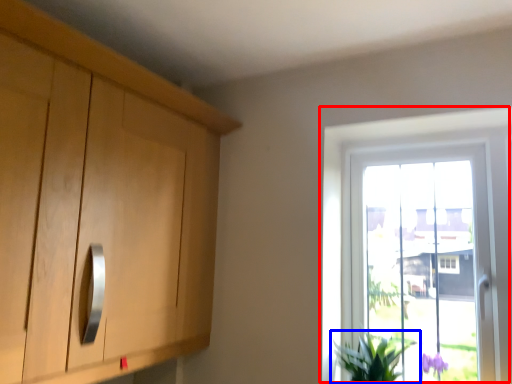
Question: Which object appears closest to the camera in this image, window (highlighted by a red box) or houseplant (highlighted by a blue box)?

Choices:
 (A) window
 (B) houseplant

Answer: (B)